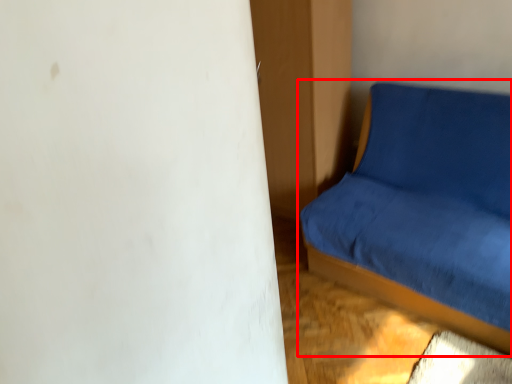
Question: Where is studio couch (annotated by the red box) located in relation to dresser in the image?

Choices:
 (A) left
 (B) right

Answer: (B)